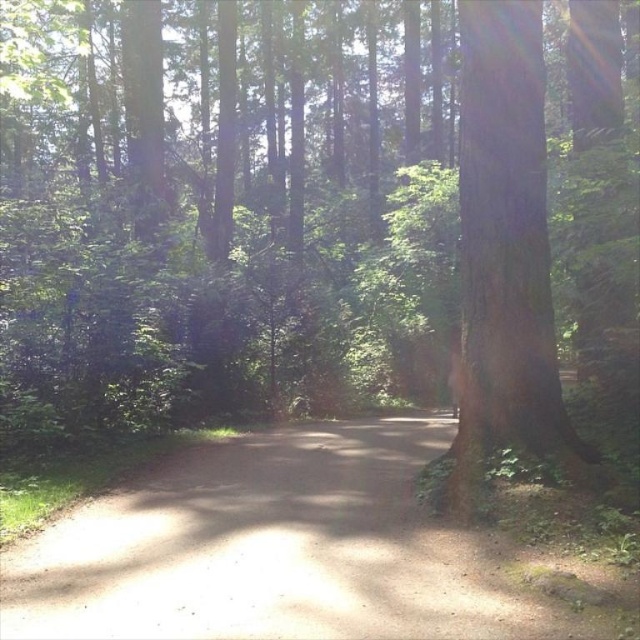
Question: Is dirt path at center closer to camera compared to smooth brown tree trunk at right?

Choices:
 (A) no
 (B) yes

Answer: (B)

Question: Which point is farther from the camera taking this photo?

Choices:
 (A) (310, 458)
 (B) (499, 152)

Answer: (A)

Question: Among these objects, which one is nearest to the camera?

Choices:
 (A) smooth brown tree trunk at right
 (B) dirt path at center

Answer: (B)

Question: Is dirt path at center below smooth brown tree trunk at right?

Choices:
 (A) no
 (B) yes

Answer: (B)

Question: Can you confirm if dirt path at center is smaller than smooth brown tree trunk at right?

Choices:
 (A) yes
 (B) no

Answer: (A)